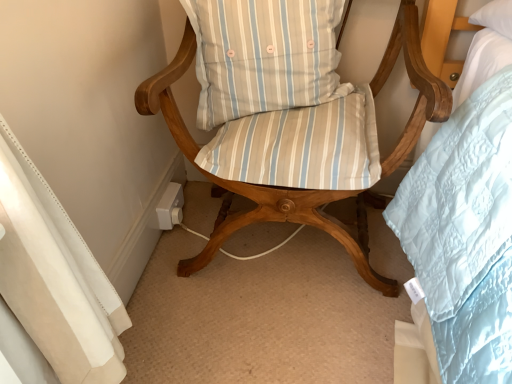
In order to face light blue striped cushion at center, should I rotate leftwards or rightwards?

Rotate right and turn 0.618 degrees.

Describe the element at coordinates (263, 56) in the screenshot. I see `light blue striped cushion at center` at that location.

The height and width of the screenshot is (384, 512). Identify the location of light blue striped cushion at center. (263, 56).

What do you see at coordinates (289, 118) in the screenshot? The image size is (512, 384). I see `wooden chair with striped cushions at center` at bounding box center [289, 118].

Where is `wooden chair with striped cushions at center`? wooden chair with striped cushions at center is located at coordinates [x=289, y=118].

This screenshot has width=512, height=384. In order to click on light blue striped cushion at center in this screenshot , I will do `click(263, 56)`.

Which is more to the left, light blue striped cushion at center or wooden chair with striped cushions at center?

Positioned to the left is light blue striped cushion at center.

Does light blue striped cushion at center lie behind wooden chair with striped cushions at center?

Yes, the depth of light blue striped cushion at center is greater than that of wooden chair with striped cushions at center.

Looking at this image, which point is more forward, [306,102] or [328,83]?

Point [306,102]

From the image's perspective, is light blue striped cushion at center located above wooden chair with striped cushions at center?

Yes, from the image's perspective, light blue striped cushion at center is on top of wooden chair with striped cushions at center.

From a real-world perspective, which object stands above the other?

light blue striped cushion at center is physically above.

Considering the relative sizes of light blue striped cushion at center and wooden chair with striped cushions at center in the image provided, is light blue striped cushion at center wider than wooden chair with striped cushions at center?

Incorrect, the width of light blue striped cushion at center does not surpass that of wooden chair with striped cushions at center.

Between light blue striped cushion at center and wooden chair with striped cushions at center, which one has less height?

light blue striped cushion at center is shorter.

Can you confirm if light blue striped cushion at center is smaller than wooden chair with striped cushions at center?

Yes, light blue striped cushion at center is smaller than wooden chair with striped cushions at center.

Is light blue striped cushion at center inside the boundaries of wooden chair with striped cushions at center, or outside?

light blue striped cushion at center is inside wooden chair with striped cushions at center.

Is light blue striped cushion at center not close to wooden chair with striped cushions at center?

No, there isn't a large distance between light blue striped cushion at center and wooden chair with striped cushions at center.

Looking at this image, is light blue striped cushion at center positioned with its back to wooden chair with striped cushions at center?

Yes, wooden chair with striped cushions at center is at the back of light blue striped cushion at center.

This screenshot has height=384, width=512. What are the coordinates of `pillow that appears on the left of wooden chair with striped cushions at center` in the screenshot? It's located at (263, 56).

Is wooden chair with striped cushions at center to the left or to the right of light blue striped cushion at center in the image?

In the image, wooden chair with striped cushions at center appears on the right side of light blue striped cushion at center.

Between wooden chair with striped cushions at center and light blue striped cushion at center, which one is positioned behind?

light blue striped cushion at center is further from the camera.

Which is behind, point (265, 31) or point (204, 94)?

Positioned behind is point (204, 94).

Looking at this image, from the image's perspective, which object appears higher, wooden chair with striped cushions at center or light blue striped cushion at center?

light blue striped cushion at center.

From a real-world perspective, is wooden chair with striped cushions at center positioned above or below light blue striped cushion at center?

Clearly, from a real-world perspective, wooden chair with striped cushions at center is below light blue striped cushion at center.

Can you confirm if wooden chair with striped cushions at center is thinner than light blue striped cushion at center?

Incorrect, the width of wooden chair with striped cushions at center is not less than that of light blue striped cushion at center.

From their relative heights in the image, would you say wooden chair with striped cushions at center is taller or shorter than light blue striped cushion at center?

wooden chair with striped cushions at center is taller than light blue striped cushion at center.

Between wooden chair with striped cushions at center and light blue striped cushion at center, which one has larger size?

With larger size is wooden chair with striped cushions at center.

Would you say wooden chair with striped cushions at center is outside light blue striped cushion at center?

Yes, wooden chair with striped cushions at center is located beyond the bounds of light blue striped cushion at center.

Is wooden chair with striped cushions at center far away from light blue striped cushion at center?

No.

Is light blue striped cushion at center at the back of wooden chair with striped cushions at center?

Correct, wooden chair with striped cushions at center is looking away from light blue striped cushion at center.

What's the angular difference between wooden chair with striped cushions at center and light blue striped cushion at center's facing directions?

They differ by 2.85 degrees in their facing directions.

At what (x,y) coordinates should I click in order to perform the action: click on pillow above the wooden chair with striped cushions at center (from the image's perspective). Please return your answer as a coordinate pair (x, y). Looking at the image, I should click on (263, 56).

Locate an element on the screen. Image resolution: width=512 pixels, height=384 pixels. chair on the right of the light blue striped cushion at center is located at coordinates (289, 118).

This screenshot has height=384, width=512. What are the coordinates of `chair in front of the light blue striped cushion at center` in the screenshot? It's located at coord(289,118).